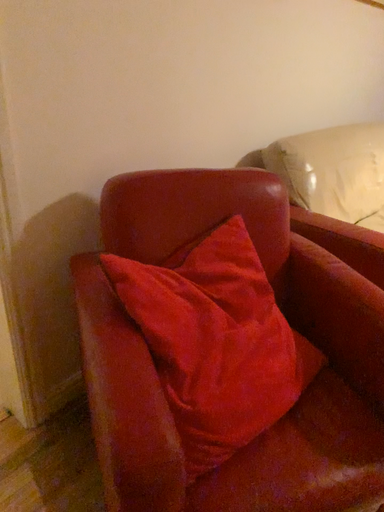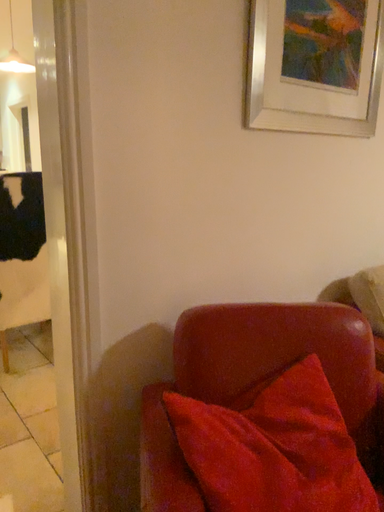
Question: How did the camera likely rotate when shooting the video?

Choices:
 (A) rotated right
 (B) rotated left

Answer: (B)